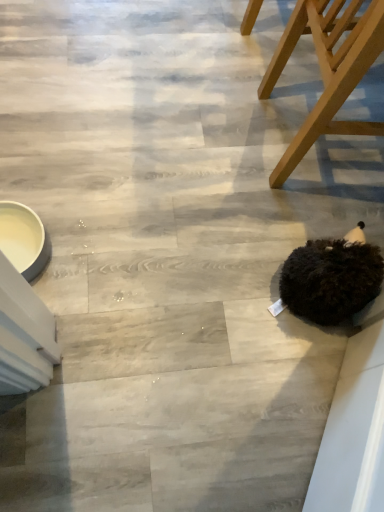
I want to click on vacant area to the left of black fuzzy ball at lower right, so click(248, 272).